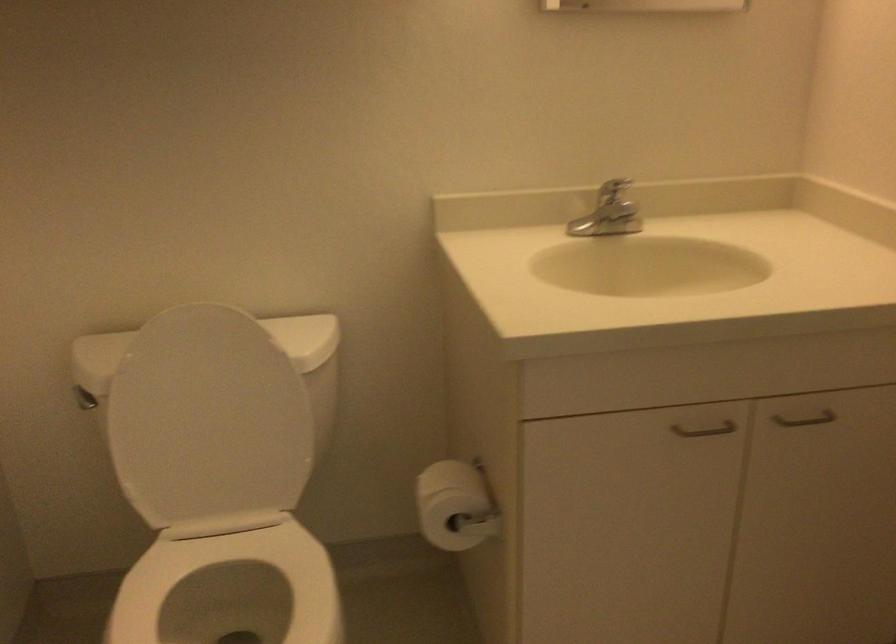
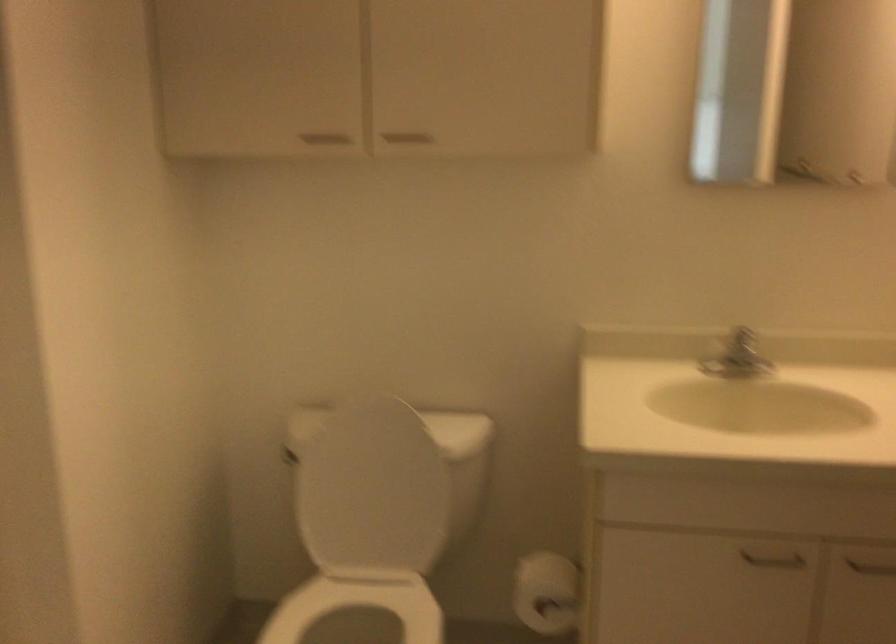
The point at (x=785, y=413) is marked in the first image. Where is the corresponding point in the second image?

(865, 563)